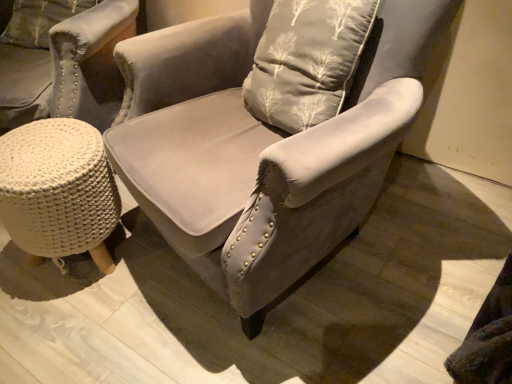
Question: Is white knitted stool at lower left to the left or to the right of velvet gray pillow with tree pattern at upper left in the image?

Choices:
 (A) left
 (B) right

Answer: (B)

Question: Looking at their shapes, would you say white knitted stool at lower left is wider or thinner than velvet gray pillow with tree pattern at upper left?

Choices:
 (A) wide
 (B) thin

Answer: (A)

Question: Estimate the real-world distances between objects in this image. Which object is closer to the velvet gray pillow with tree pattern at upper left?

Choices:
 (A) white knitted stool at lower left
 (B) suede gray armchair at center

Answer: (A)

Question: Considering the real-world distances, which object is closest to the velvet gray pillow with tree pattern at upper left?

Choices:
 (A) white knitted stool at lower left
 (B) suede gray armchair at center

Answer: (A)